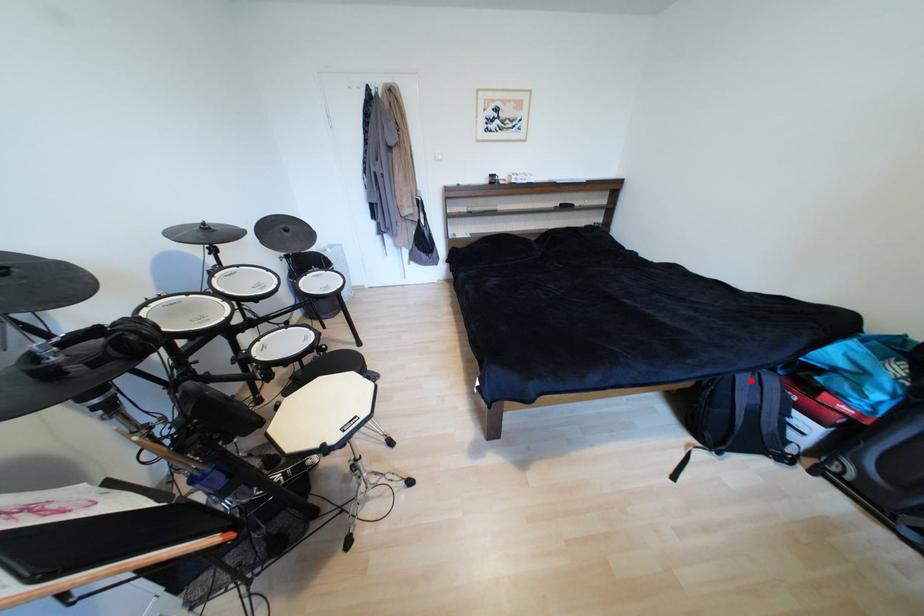
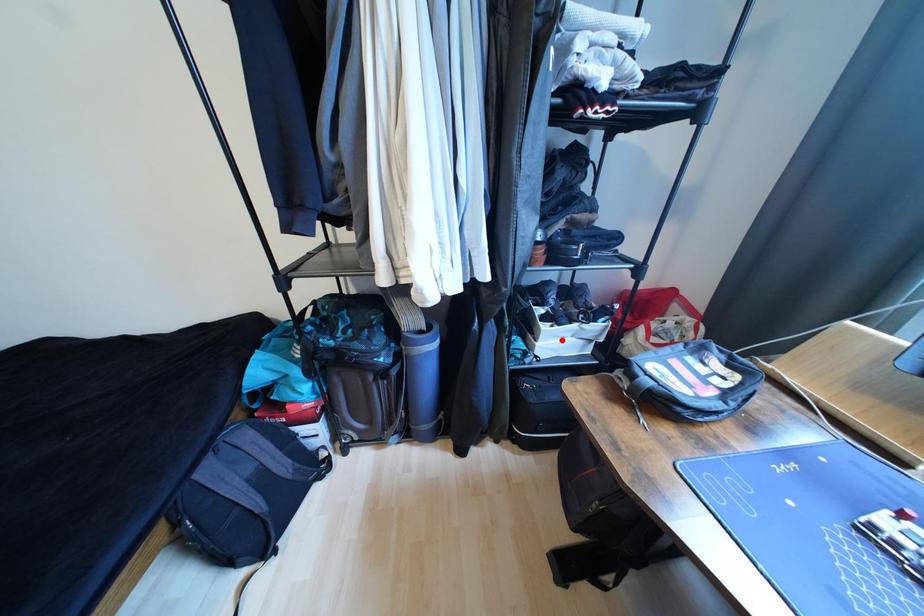
I am providing you with two images of the same scene from different viewpoints. A red point is marked on the first image and another point is marked on the second image. Are the points marked in image1 and image2 representing the same 3D position?

No